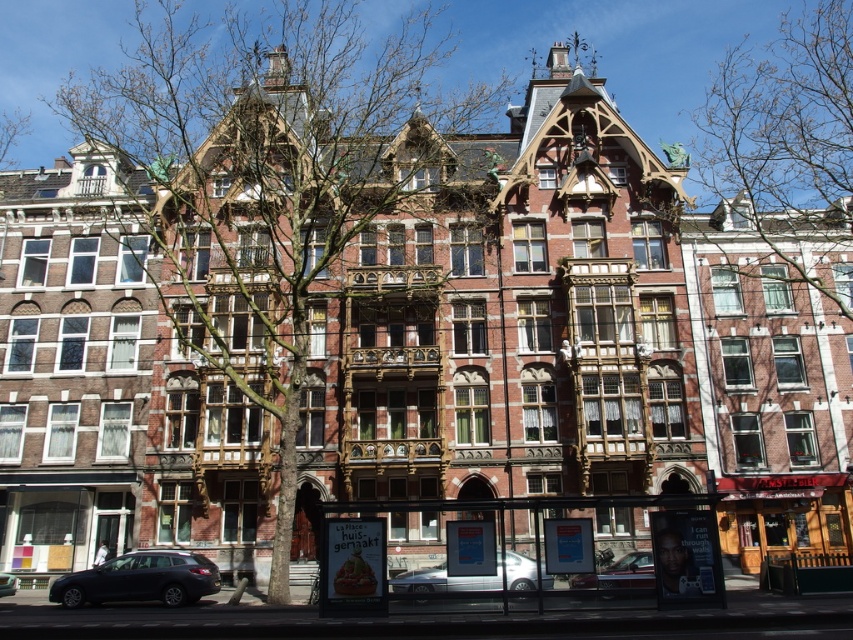
Question: Considering the relative positions of matte black car at lower left and shiny black sedan at lower left in the image provided, where is matte black car at lower left located with respect to shiny black sedan at lower left?

Choices:
 (A) above
 (B) below

Answer: (A)

Question: Among these points, which one is farthest from the camera?

Choices:
 (A) (792, 216)
 (B) (521, 586)
 (C) (165, 298)
 (D) (593, 584)

Answer: (A)

Question: Observing the image, what is the correct spatial positioning of shiny silver car at center in reference to shiny black sedan at lower left?

Choices:
 (A) below
 (B) above

Answer: (B)

Question: Does matte black car at lower left have a smaller size compared to bare branches at upper left?

Choices:
 (A) yes
 (B) no

Answer: (A)

Question: Based on their relative distances, which object is nearer to the shiny silver car at center?

Choices:
 (A) bare branches at upper center
 (B) matte black car at lower left

Answer: (B)

Question: Which point appears farthest from the camera in this image?

Choices:
 (A) (161, 554)
 (B) (729, 170)
 (C) (160, 228)
 (D) (21, 112)

Answer: (D)